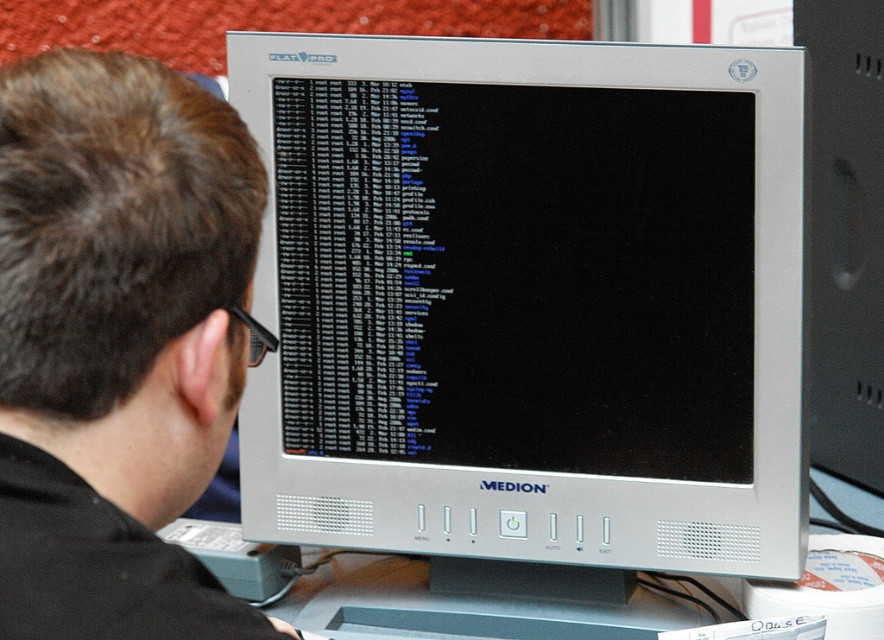
Question: Does silver metallic computer monitor at center come in front of black matte monitor at upper center?

Choices:
 (A) yes
 (B) no

Answer: (B)

Question: In this image, where is silver metallic computer monitor at center located relative to black matte monitor at upper center?

Choices:
 (A) left
 (B) right

Answer: (B)

Question: Which object is farther from the camera taking this photo?

Choices:
 (A) silver metallic computer monitor at center
 (B) black matte monitor at upper center

Answer: (A)

Question: Which of the following is the farthest from the observer?

Choices:
 (A) (356, 253)
 (B) (202, 172)

Answer: (A)

Question: Can you confirm if silver metallic computer monitor at center is smaller than black matte monitor at upper center?

Choices:
 (A) no
 (B) yes

Answer: (A)

Question: Among these points, which one is farthest from the camera?

Choices:
 (A) (93, 572)
 (B) (644, 323)

Answer: (B)